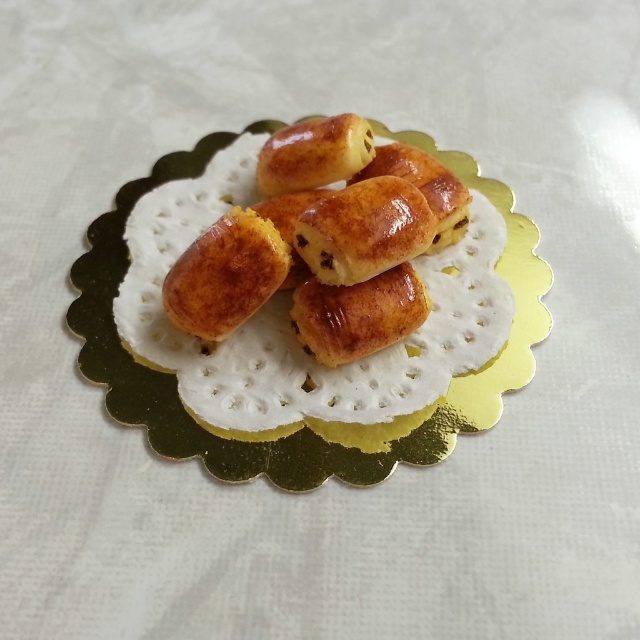
Question: Which of the following is the closest to the observer?

Choices:
 (A) golden paper doily at center
 (B) golden glazed pastry at center

Answer: (B)

Question: Is golden glazed pastry at center bigger than golden paper doily at center?

Choices:
 (A) yes
 (B) no

Answer: (B)

Question: Which object is closer to the camera taking this photo?

Choices:
 (A) golden glazed pastry at center
 (B) golden paper doily at center

Answer: (A)

Question: Can you confirm if golden glazed pastry at center is positioned to the right of golden paper doily at center?

Choices:
 (A) yes
 (B) no

Answer: (B)

Question: Does golden glazed pastry at center have a lesser width compared to golden paper doily at center?

Choices:
 (A) yes
 (B) no

Answer: (A)

Question: Which of the following is the farthest from the observer?

Choices:
 (A) golden glazed pastry at center
 (B) golden paper doily at center

Answer: (B)